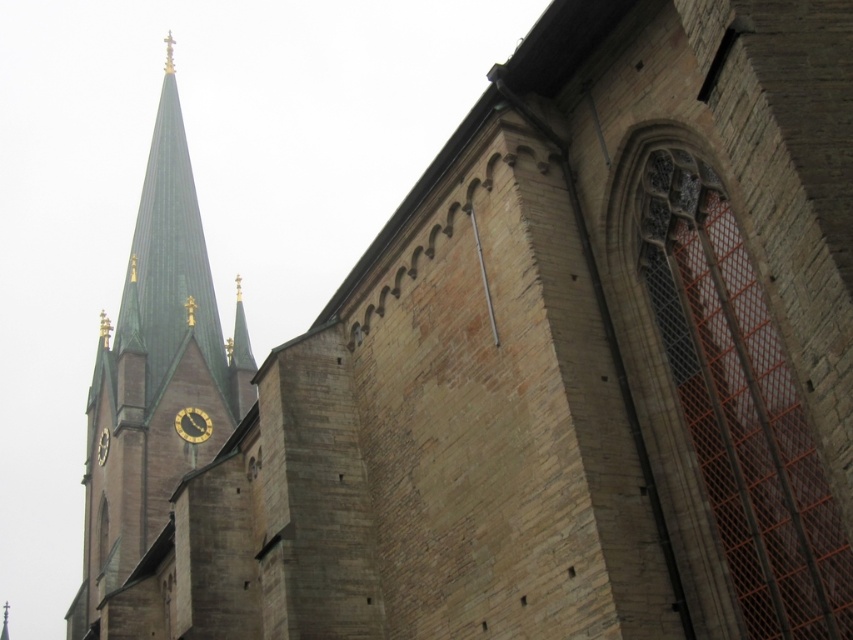
Question: Which object appears farthest from the camera in this image?

Choices:
 (A) green slate spire at upper left
 (B) gold metallic clock at center-left
 (C) gold metallic clock at center

Answer: (B)

Question: Estimate the real-world distances between objects in this image. Which object is farther from the green slate spire at upper left?

Choices:
 (A) gold metallic clock at center
 (B) gold metallic clock at center-left

Answer: (B)

Question: Can you confirm if green slate spire at upper left is thinner than gold metallic clock at center?

Choices:
 (A) no
 (B) yes

Answer: (A)

Question: Is green slate spire at upper left below gold metallic clock at center-left?

Choices:
 (A) yes
 (B) no

Answer: (B)

Question: Considering the relative positions of gold metallic clock at center and gold metallic clock at center-left in the image provided, where is gold metallic clock at center located with respect to gold metallic clock at center-left?

Choices:
 (A) below
 (B) above

Answer: (B)

Question: Which object is positioned farthest from the gold metallic clock at center-left?

Choices:
 (A) green slate spire at upper left
 (B) gold metallic clock at center

Answer: (A)